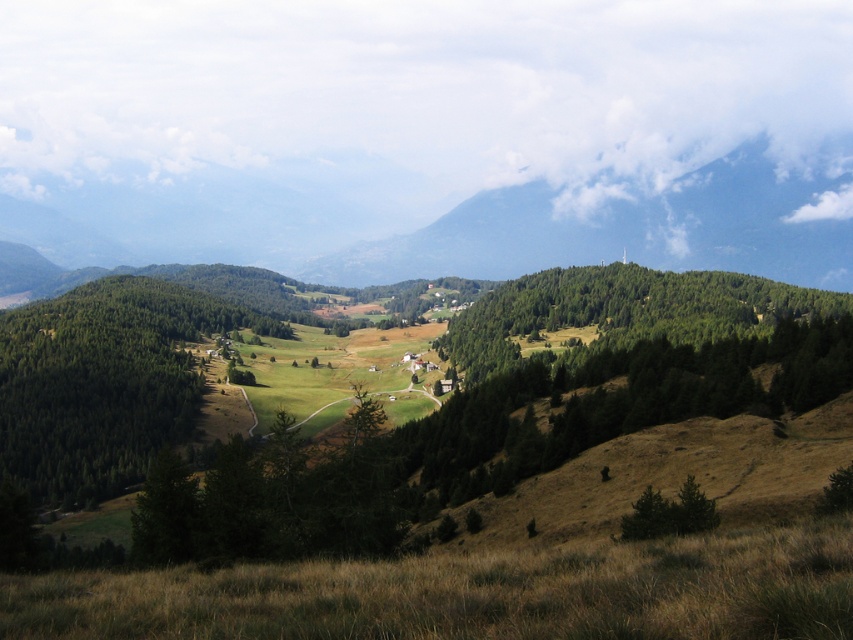
You are planning to take a photo of the green forested mountain at upper center and the green leafy tree at center. Which object should you focus on first if you want to capture both in a single frame without moving the camera?

You should focus on the green forested mountain at upper center first because it is larger in size compared to the green leafy tree at center, ensuring it fits well within the frame.

You are standing at the base of the green matte tree at lower left and want to walk to the green leafy tree at center. How far will you have to walk?

The green matte tree at lower left is 104.46 meters away from the green leafy tree at center, so you will have to walk 104.46 meters to reach it.

You are a hiker standing at the valley bottom looking towards the mountains. You see the green matte tree at lower left and the green leafy tree at center. Which tree would block your view of the mountains if you were to stand directly behind it?

The green matte tree at lower left is much taller than the green leafy tree at center, so standing behind the green matte tree at lower left would block your view of the mountains more than the green leafy tree at center.